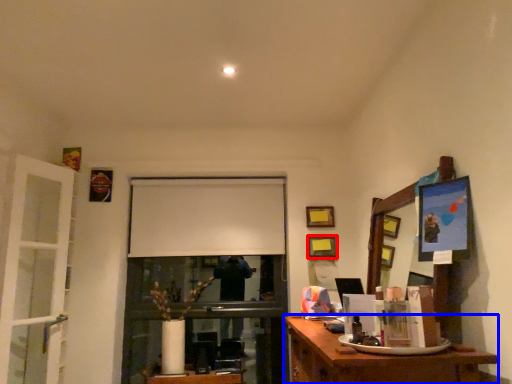
Question: Among these objects, which one is farthest to the camera, picture frame (highlighted by a red box) or desk (highlighted by a blue box)?

Choices:
 (A) picture frame
 (B) desk

Answer: (A)